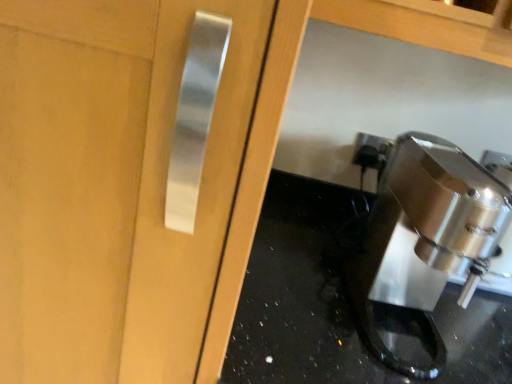
The image size is (512, 384). I want to click on satin silver coffee maker at lower right, so click(x=425, y=234).

Describe the element at coordinates (425, 234) in the screenshot. I see `satin silver coffee maker at lower right` at that location.

The image size is (512, 384). What are the coordinates of `satin silver coffee maker at lower right` in the screenshot? It's located at (425, 234).